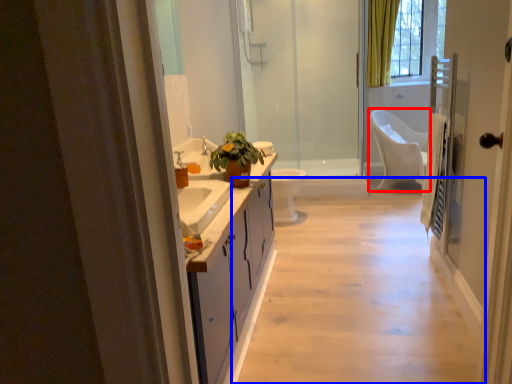
Question: Which of the following is the closest to the observer, chair (highlighted by a red box) or plain (highlighted by a blue box)?

Choices:
 (A) chair
 (B) plain

Answer: (B)